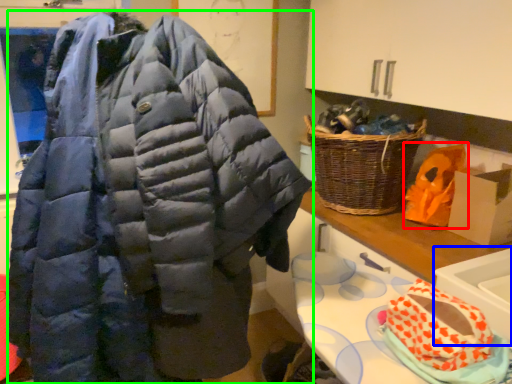
Question: Which is farther away from stuff (highlighted by a red box)? sink (highlighted by a blue box) or jacket (highlighted by a green box)?

Choices:
 (A) sink
 (B) jacket

Answer: (B)